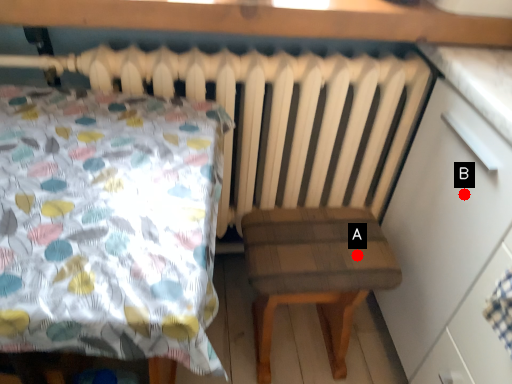
Question: Two points are circled on the image, labeled by A and B beside each circle. Which point is further to the camera?

Choices:
 (A) A is further
 (B) B is further

Answer: (A)